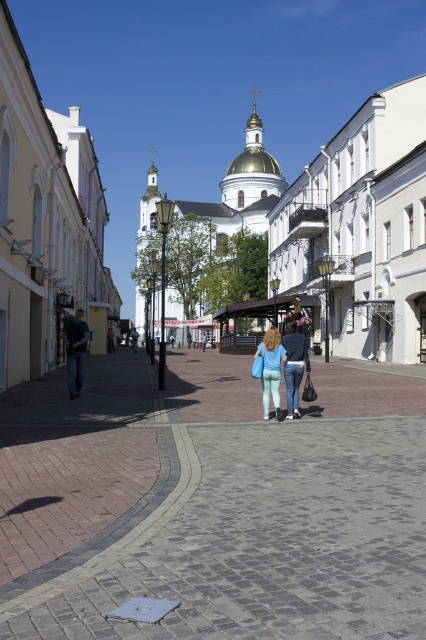
You are a tourist visiting the European town and want to walk from the gray cobblestone pavement at center to the denim pants at center. Which path should you take if you want to avoid stepping on the smaller object?

You should avoid stepping on the denim pants at center since it is smaller than the gray cobblestone pavement at center, so the denim pants at center is the smaller object to avoid.

You are standing at the base of the grand white church with a golden dome and need to reach the point marked at coordinates (213,502). According to the image, what type of surface will you be walking on to reach that point?

The point at (213,502) is on gray cobblestone pavement at center, so you will be walking on gray cobblestone pavement to reach that point.

You are standing on the gray cobblestone pavement at center and looking towards the denim pants at center. Which object is closer to you?

The gray cobblestone pavement at center is closer to you than the denim pants at center.